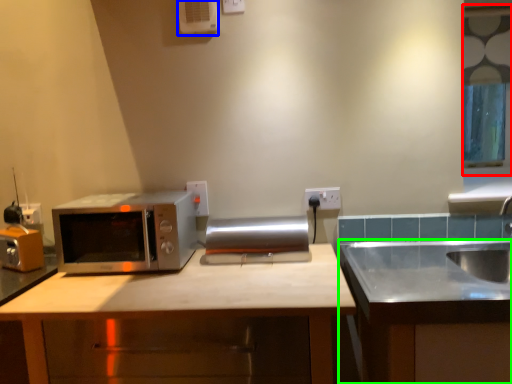
Question: Based on their relative distances, which object is farther from window (highlighted by a red box)? Choose from air conditioner (highlighted by a blue box) and cabinetry (highlighted by a green box).

Choices:
 (A) air conditioner
 (B) cabinetry

Answer: (A)